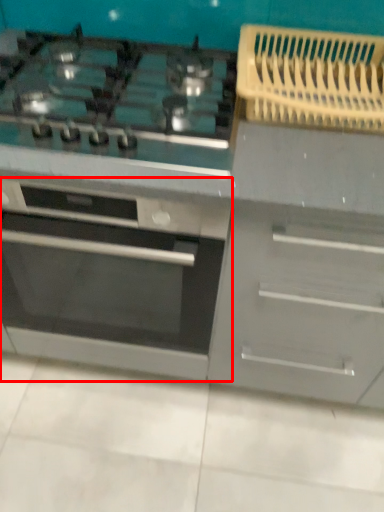
Question: From the image, what is the correct spatial relationship of oven (annotated by the red box) in relation to gas stove?

Choices:
 (A) left
 (B) right

Answer: (A)